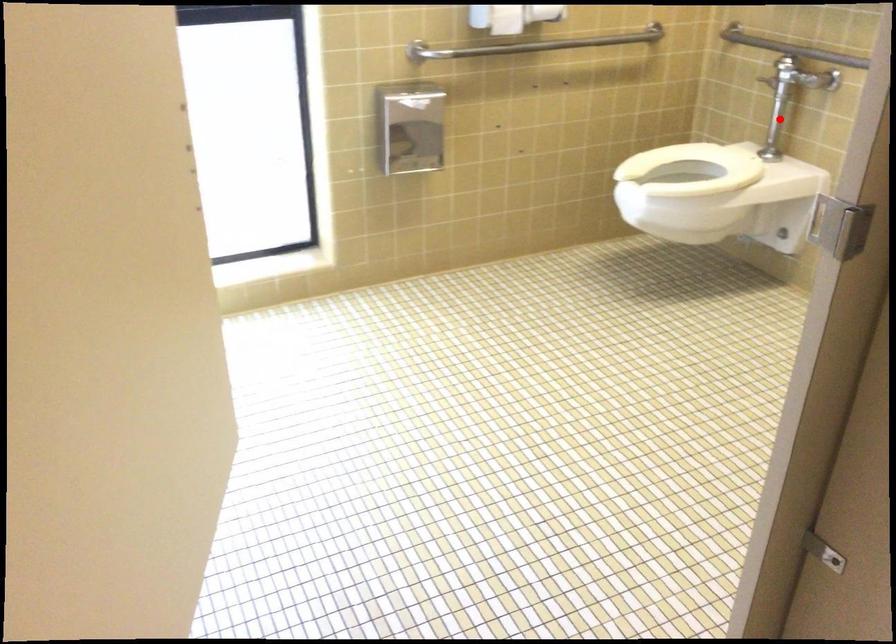
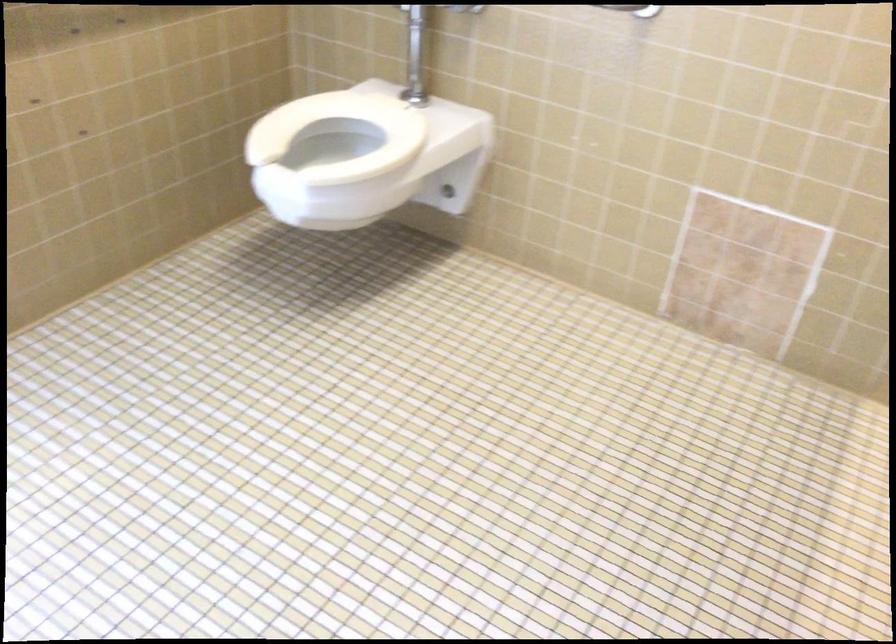
Question: A red point is marked in image1. In image2, is the corresponding 3D point closer to the camera or farther? Reply with the corresponding letter.

Choices:
 (A) The corresponding 3D point is closer.
 (B) The corresponding 3D point is farther.

Answer: (A)